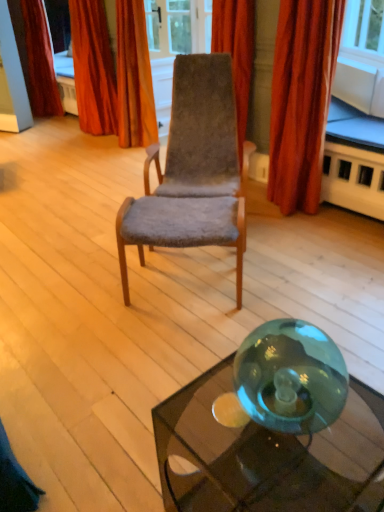
This screenshot has height=512, width=384. Find the location of `vacant area on top of transparent glass table at lower right, the first table viewed from the front (from a real-world perspective)`. vacant area on top of transparent glass table at lower right, the first table viewed from the front (from a real-world perspective) is located at coordinates (256, 439).